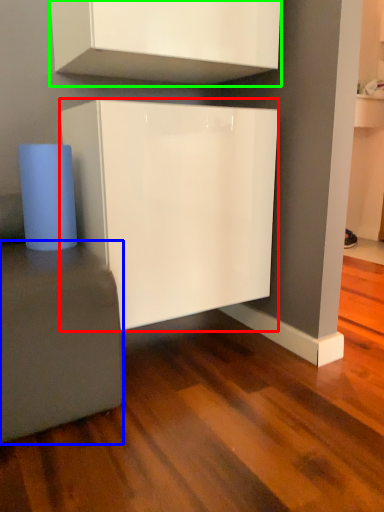
Question: Which object is the farthest from cabinetry (highlighted by a red box)? Choose among these: furniture (highlighted by a blue box) or cabinetry (highlighted by a green box).

Choices:
 (A) furniture
 (B) cabinetry

Answer: (B)